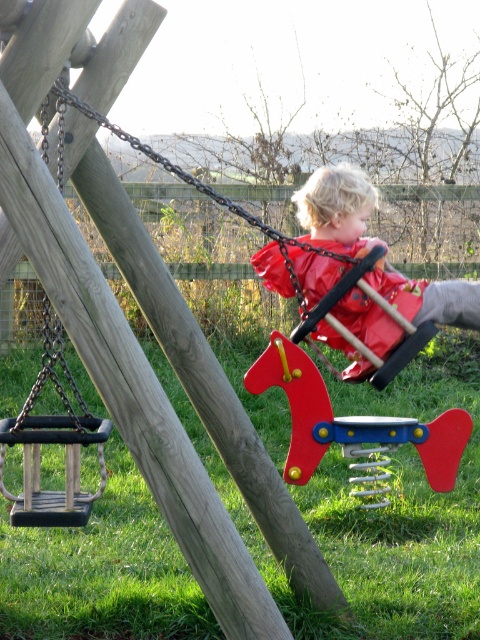
Between rubberized red swing at center and wooden swing at center, which one appears on the left side from the viewer's perspective?

Positioned to the left is wooden swing at center.

Who is taller, rubberized red swing at center or wooden swing at center?

With more height is wooden swing at center.

Who is more distant from viewer, (389, 280) or (384, 381)?

Positioned behind is point (389, 280).

I want to click on rubberized red swing at center, so click(336, 209).

Does red plastic spring at center have a greater width compared to wooden swing at center?

No, red plastic spring at center is not wider than wooden swing at center.

Between red plastic spring at center and wooden swing at center, which one appears on the right side from the viewer's perspective?

Positioned to the right is red plastic spring at center.

This screenshot has height=640, width=480. Identify the location of red plastic spring at center. (350, 420).

Who is higher up, rubberized red swing at center or red plastic spring at center?

Positioned higher is rubberized red swing at center.

The width and height of the screenshot is (480, 640). Describe the element at coordinates (336, 209) in the screenshot. I see `rubberized red swing at center` at that location.

Describe the element at coordinates (336, 209) in the screenshot. The width and height of the screenshot is (480, 640). I see `rubberized red swing at center` at that location.

Identify the location of rubberized red swing at center. (336, 209).